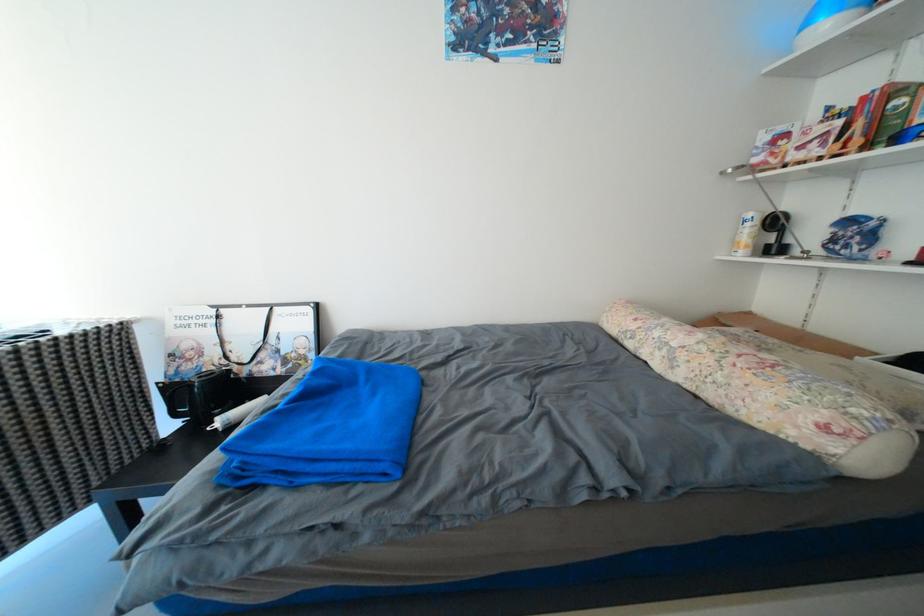
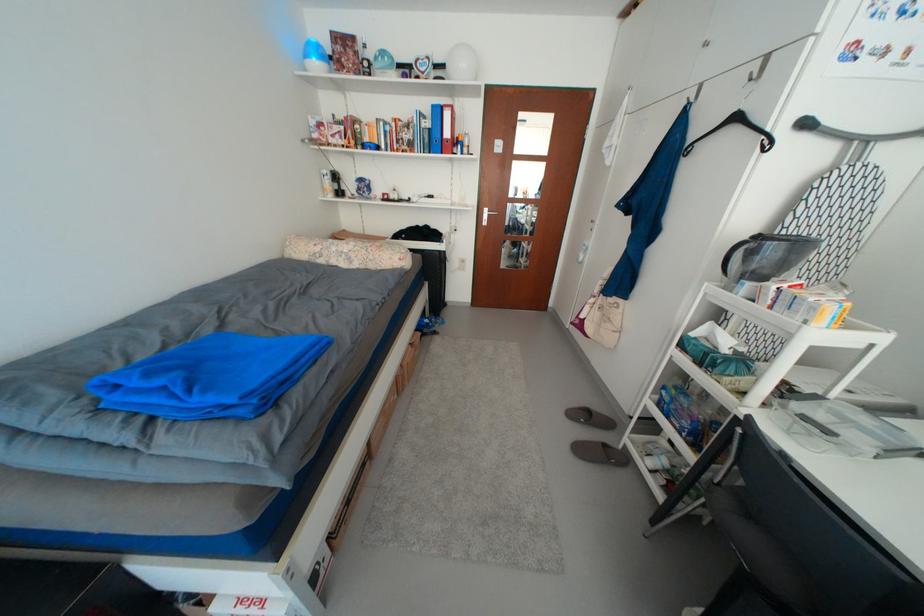
First-person continuous shooting, in which direction is the camera rotating?

The camera rotated toward right-down.